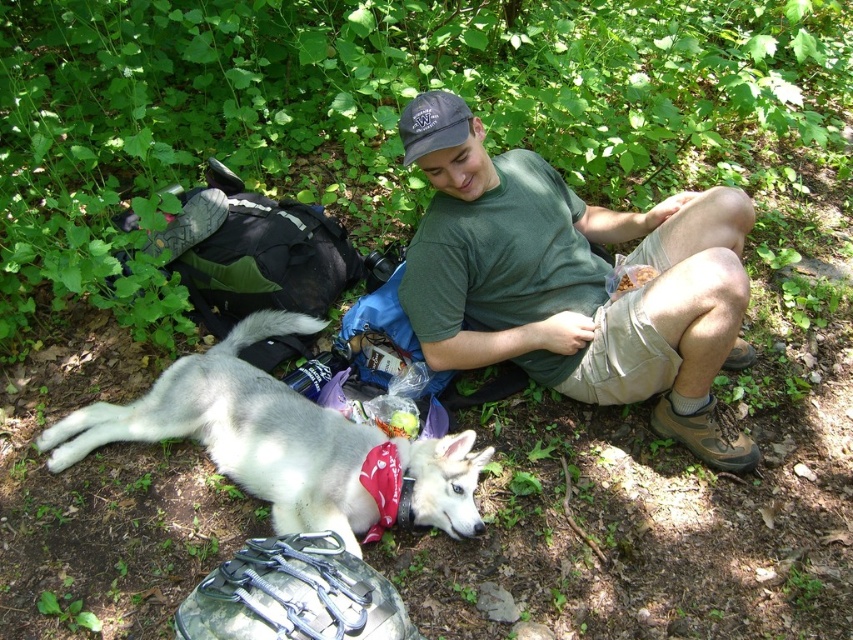
Question: Which point is farther to the camera?

Choices:
 (A) (445, 144)
 (B) (543, 186)
 (C) (291, 417)

Answer: (B)

Question: Can you confirm if white fur dog at lower left is smaller than dark gray fabric baseball cap at center?

Choices:
 (A) yes
 (B) no

Answer: (B)

Question: Is green cotton shirt at center thinner than white fur dog at lower left?

Choices:
 (A) no
 (B) yes

Answer: (B)

Question: Considering the real-world distances, which object is farthest from the green cotton shirt at center?

Choices:
 (A) dark gray fabric baseball cap at center
 (B) white fur dog at lower left

Answer: (B)

Question: Can you confirm if white fur dog at lower left is positioned to the left of dark gray fabric baseball cap at center?

Choices:
 (A) no
 (B) yes

Answer: (B)

Question: Which point is farther to the camera?

Choices:
 (A) (296, 508)
 (B) (495, 282)
 (C) (428, 152)

Answer: (B)